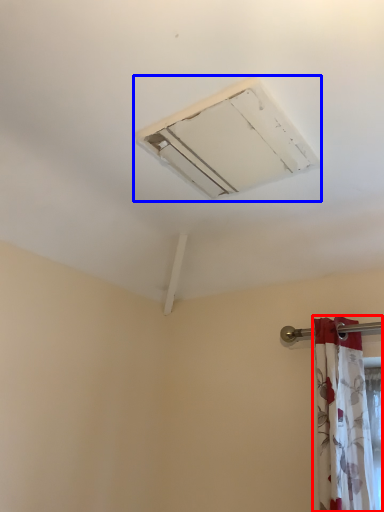
Question: Which object appears farthest to the camera in this image, curtain (highlighted by a red box) or air conditioning (highlighted by a blue box)?

Choices:
 (A) curtain
 (B) air conditioning

Answer: (A)